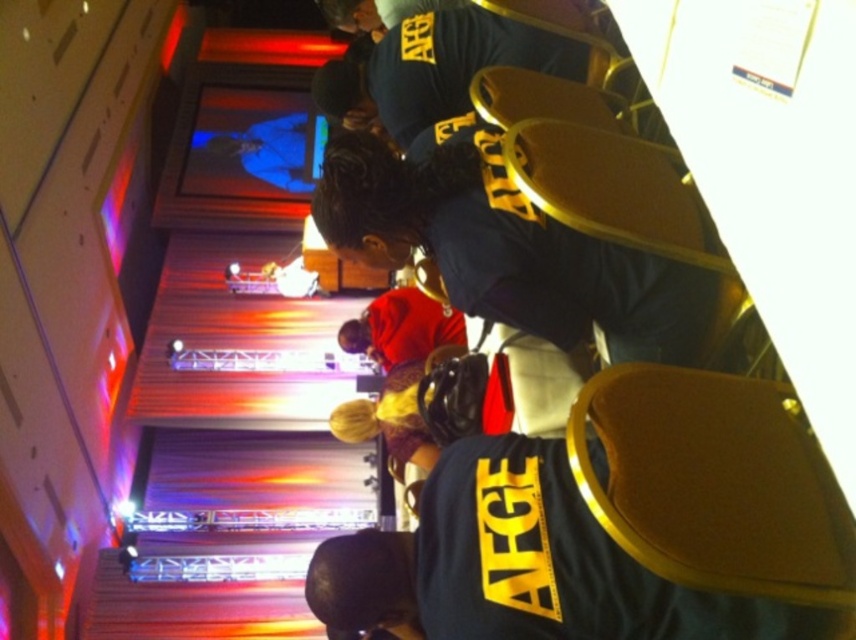
Is dark blue shirt at center to the right of red velvet jacket at center from the viewer's perspective?

Yes, dark blue shirt at center is to the right of red velvet jacket at center.

Can you confirm if dark blue shirt at center is thinner than red velvet jacket at center?

Incorrect, dark blue shirt at center's width is not less than red velvet jacket at center's.

Does point (682, 355) come behind point (375, 314)?

No, (682, 355) is closer to viewer.

Where is `dark blue shirt at center`? Image resolution: width=856 pixels, height=640 pixels. dark blue shirt at center is located at coordinates [x=509, y=248].